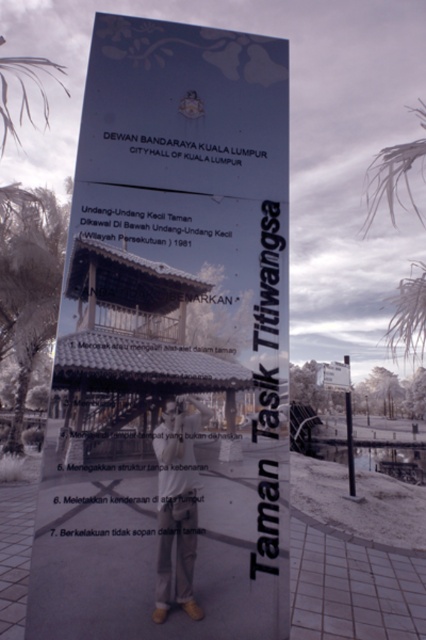
Question: Which object appears closest to the camera in this image?

Choices:
 (A) brown leather shoes at lower center
 (B) green leafy palm tree at left
 (C) metallic pole at center
 (D) white frosty palm tree at upper right

Answer: (A)

Question: Does green leafy palm tree at left have a lesser width compared to metallic pole at center?

Choices:
 (A) yes
 (B) no

Answer: (A)

Question: Estimate the real-world distances between objects in this image. Which object is farther from the green leafy palm tree at left?

Choices:
 (A) transparent plastic sign at center
 (B) white frosty palm tree at upper right
 (C) brown leather shoes at lower center

Answer: (C)

Question: Is green leafy palm tree at left thinner than brown leather shoes at lower center?

Choices:
 (A) yes
 (B) no

Answer: (B)

Question: Which point appears farthest from the camera in this image?

Choices:
 (A) (178, 472)
 (B) (348, 385)
 (C) (264, 182)
 (D) (405, 300)

Answer: (B)

Question: Can you confirm if green leafy palm tree at left is positioned above metallic pole at center?

Choices:
 (A) no
 (B) yes

Answer: (B)